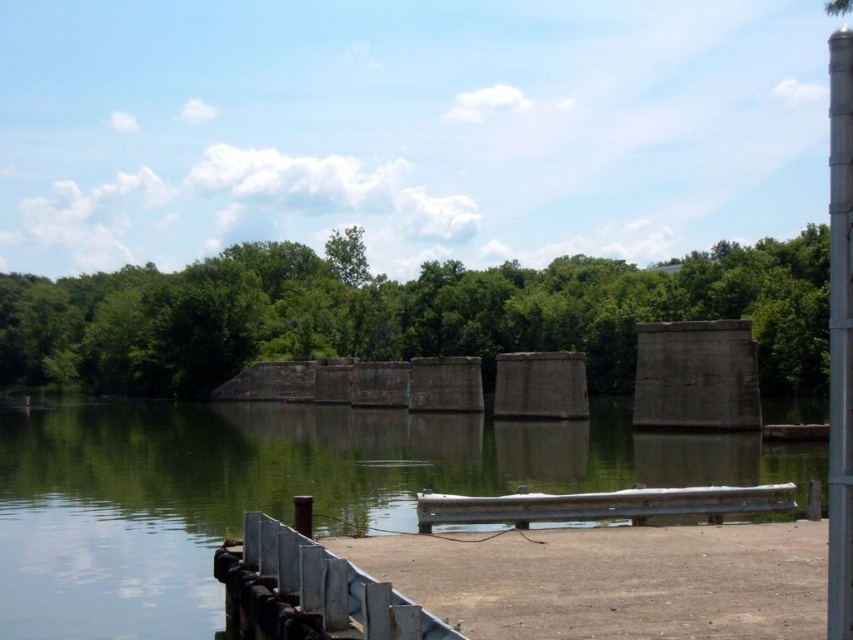
Which is more to the right, green concrete river at center or metallic gray park bench at lower center?

Positioned to the right is metallic gray park bench at lower center.

Between point (55, 637) and point (735, 488), which one is positioned in front?

Point (55, 637) is in front.

Is point (187, 545) behind point (489, 504)?

Yes, it is.

Find the location of a particular element. green concrete river at center is located at coordinates (280, 492).

Who is positioned more to the left, green concrete river at center or green leafy trees at center?

From the viewer's perspective, green concrete river at center appears more on the left side.

Measure the distance between green concrete river at center and camera.

They are 18.39 meters apart.

Between point (216, 444) and point (606, 353), which one is positioned behind?

Positioned behind is point (606, 353).

Locate an element on the screen. The image size is (853, 640). green concrete river at center is located at coordinates (280, 492).

Does green leafy trees at center appear on the right side of metallic gray park bench at lower center?

Indeed, green leafy trees at center is positioned on the right side of metallic gray park bench at lower center.

Is green leafy trees at center below metallic gray park bench at lower center?

Actually, green leafy trees at center is above metallic gray park bench at lower center.

Where is `green leafy trees at center`? The height and width of the screenshot is (640, 853). green leafy trees at center is located at coordinates (403, 314).